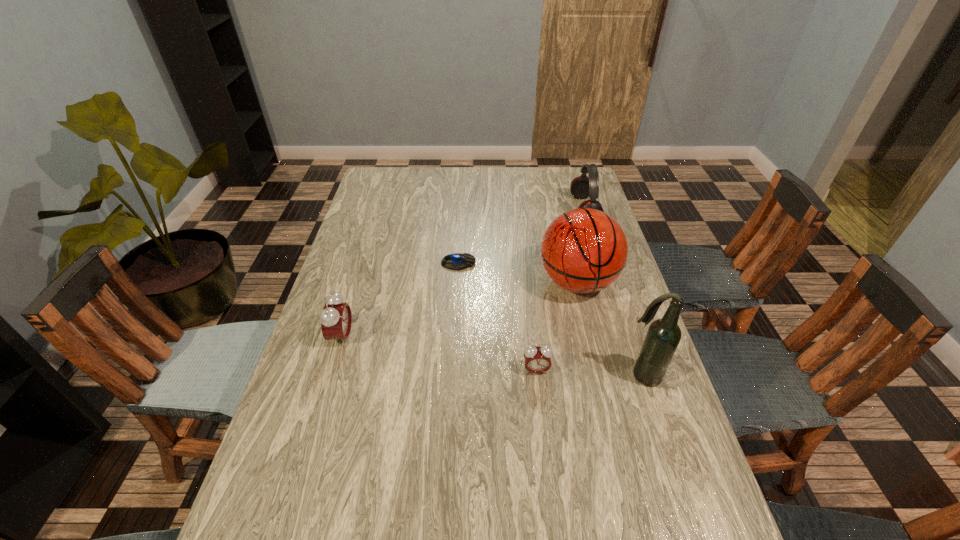
Where is `empty location between the basketball and the leftmost object`? empty location between the basketball and the leftmost object is located at coordinates (460, 309).

Where is `free spot between the basketball and the shortest object`? This screenshot has width=960, height=540. free spot between the basketball and the shortest object is located at coordinates (517, 273).

Identify the location of free space between the nearer alarm clock and the fifth object from right to left. (497, 317).

This screenshot has width=960, height=540. What are the coordinates of `free space between the third nearest object and the shortest object` in the screenshot? It's located at point(400,300).

In order to click on free space between the basketball and the right alarm clock in this screenshot , I will do `click(557, 326)`.

The height and width of the screenshot is (540, 960). In order to click on unoccupied area between the beer bottle and the second shortest object in this screenshot , I will do `click(589, 373)`.

The image size is (960, 540). I want to click on free point between the fourth farthest object and the earphone, so click(x=463, y=273).

Find the location of `vacant space that's between the basketball and the shorter alarm clock`. vacant space that's between the basketball and the shorter alarm clock is located at coordinates (557, 326).

Locate an element on the screen. The image size is (960, 540). the third closest object to the earphone is located at coordinates (663, 336).

The width and height of the screenshot is (960, 540). I want to click on the fourth closest object to the right alarm clock, so click(336, 318).